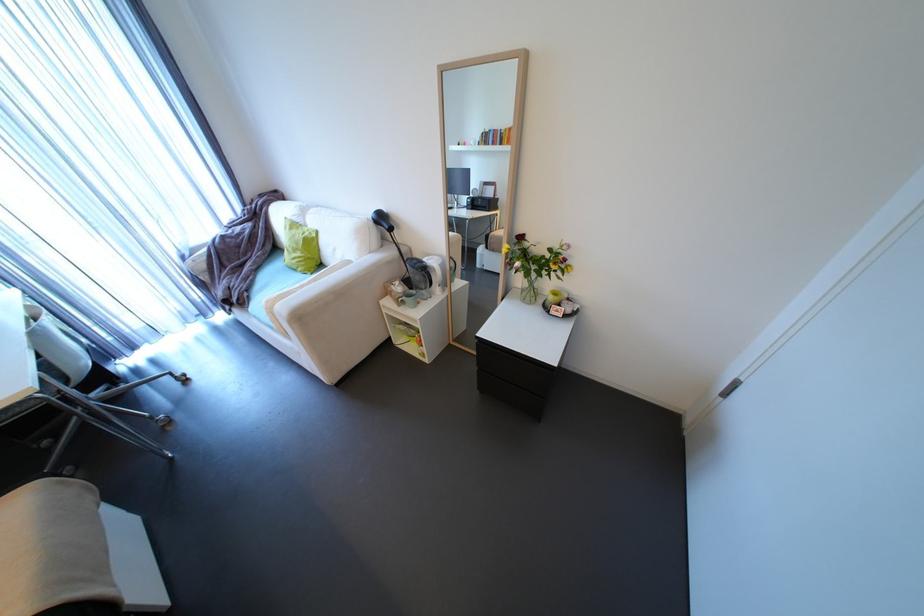
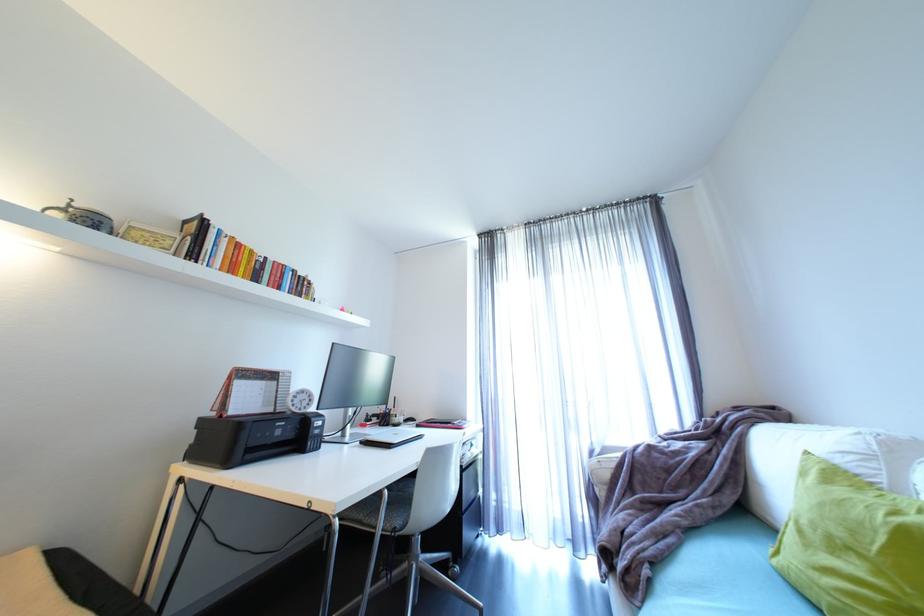
The point at (46, 395) is marked in the first image. Where is the corresponding point in the second image?

(344, 522)